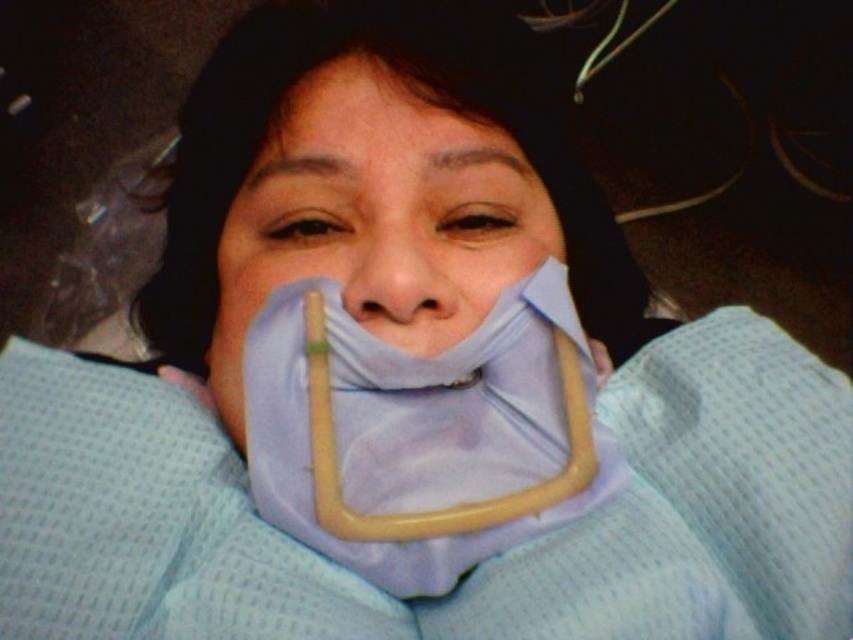
Consider the image. You are a medical technician holding a tool that needs to be placed exactly at point (370, 346). The tool has a handle that is 6 inches long. If you position the handle so it points directly away from the camera, will the entire handle fit within the frame?

The point (370, 346) is 16.28 inches away from the camera. Since the handle is only 6 inches long, positioning it pointing away from the camera would mean the total distance from the camera to the end of the handle would be 16.28 inches plus 6 inches, totaling 22.28 inches. However, the question is about whether the entire handle fits within the frame, not about distance. The description does not provide information about the frame dimensions or the field of view, so we cannot determine if the handle will

Please describe the object located at point (422,433) in the image. Your answer should include the object label from the provided objects and its color.

The object at point (422,433) is the light blue fabric at center.

You are a medical technician in a hospital. You need to place a sensor on the patient. There are two points marked on the patient, one at point coordinates point (x=567, y=500) and another at point (x=480, y=241). Which point is closer to you, the technician, when you are facing the patient?

Point (x=567, y=500) is in front of point (x=480, y=241), so the point closer to you would be point (x=567, y=500).